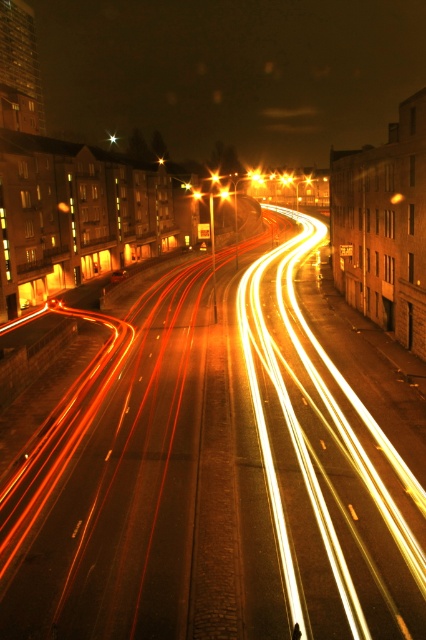
Does orange light at center have a greater width compared to metallic orange light at center?

Yes.

Which is more to the right, orange light at center or metallic orange light at center?

Positioned to the right is orange light at center.

Locate an element on the screen. The height and width of the screenshot is (640, 426). orange light at center is located at coordinates coord(224,193).

Image resolution: width=426 pixels, height=640 pixels. Describe the element at coordinates (256, 177) in the screenshot. I see `amber glass traffic light at center` at that location.

Based on the photo, is amber glass traffic light at center below metallic orange light at center?

No, amber glass traffic light at center is not below metallic orange light at center.

Does point (253, 179) come behind point (195, 198)?

Yes, it is.

Where is `amber glass traffic light at center`? amber glass traffic light at center is located at coordinates (256, 177).

Which is behind, point (261, 182) or point (222, 189)?

The point (261, 182) is behind.

Is point (253, 172) farther from camera compared to point (224, 189)?

Yes, point (253, 172) is farther from viewer.

Identify the location of amber glass traffic light at center. The height and width of the screenshot is (640, 426). (256, 177).